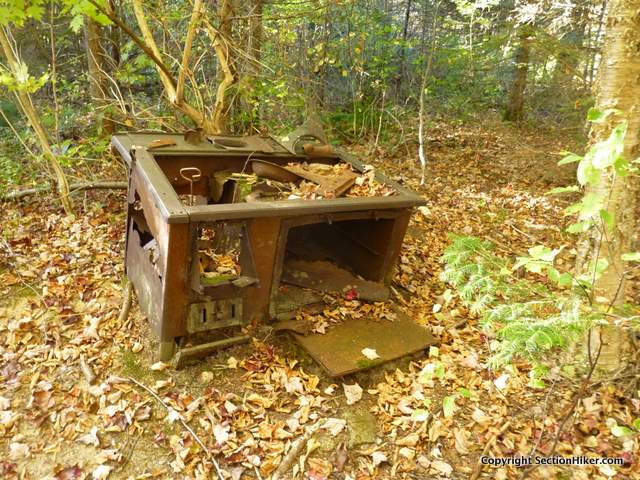
This screenshot has width=640, height=480. Identify the location of grate. (217, 316).